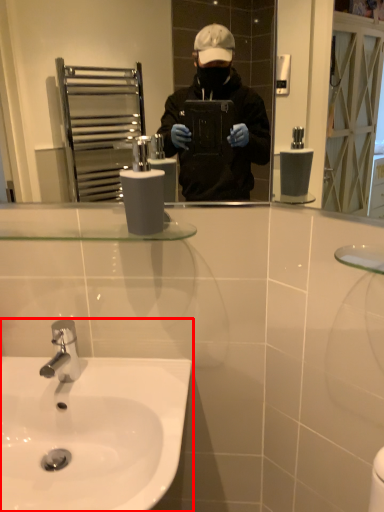
Question: From the image's perspective, what is the correct spatial positioning of sink (annotated by the red box) in reference to toilet paper?

Choices:
 (A) below
 (B) above

Answer: (A)